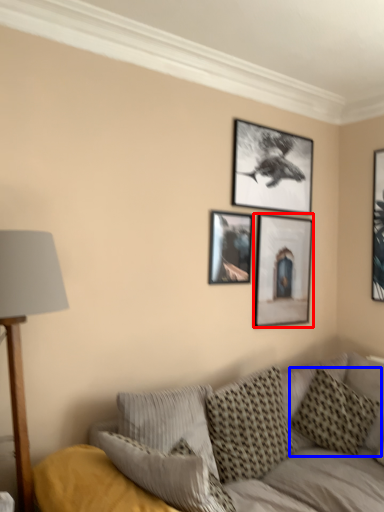
Question: Which of the following is the farthest to the observer, picture frame (highlighted by a red box) or pillow (highlighted by a blue box)?

Choices:
 (A) picture frame
 (B) pillow

Answer: (A)